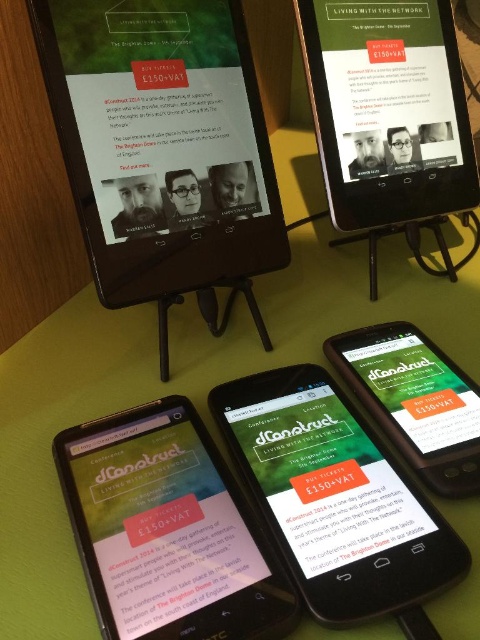
You are setting up a promotional display for an event. You have a matte black tablet at upper center and a green matte smartphone at center. Which device is closer to the viewer?

The matte black tablet at upper center is closer to the viewer as it is positioned in front of the green matte smartphone at center.